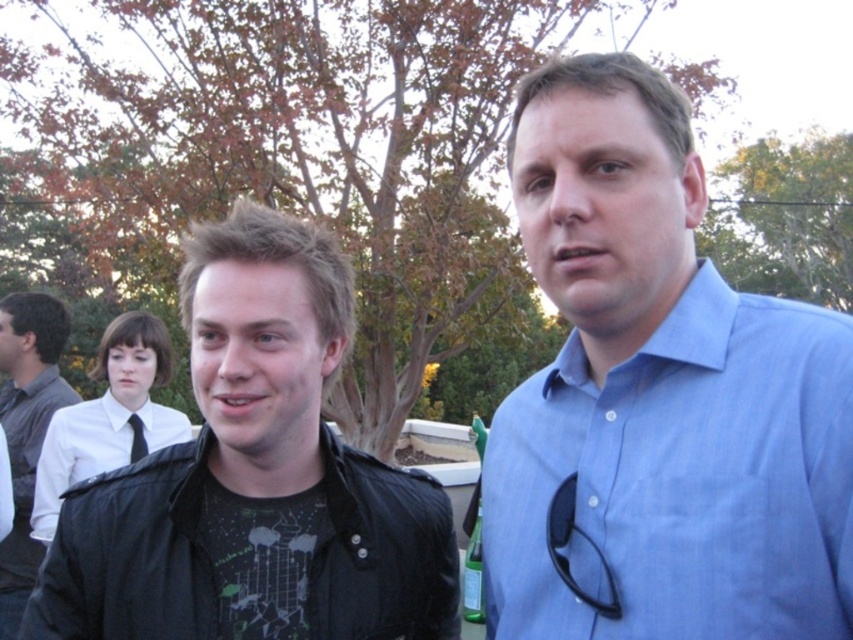
Question: Which of the following is the closest to the observer?

Choices:
 (A) black leather jacket at lower left
 (B) blue cotton shirt at upper right
 (C) dark gray shirt at left

Answer: (B)

Question: Which point is farther from the camera taking this photo?

Choices:
 (A) (326, 628)
 (B) (122, 428)
 (C) (136, 435)

Answer: (B)

Question: Can you confirm if black leather jacket at lower left is positioned to the right of dark gray shirt at left?

Choices:
 (A) no
 (B) yes

Answer: (B)

Question: Considering the relative positions of dark gray shirt at left and black silk tie at center in the image provided, where is dark gray shirt at left located with respect to black silk tie at center?

Choices:
 (A) right
 (B) left

Answer: (B)

Question: From the image, what is the correct spatial relationship of blue cotton shirt at upper right in relation to dark gray shirt at left?

Choices:
 (A) left
 (B) right

Answer: (B)

Question: Which point is closer to the camera?

Choices:
 (A) dark gray shirt at left
 (B) black silk tie at center
 (C) black leather jacket at lower left

Answer: (C)